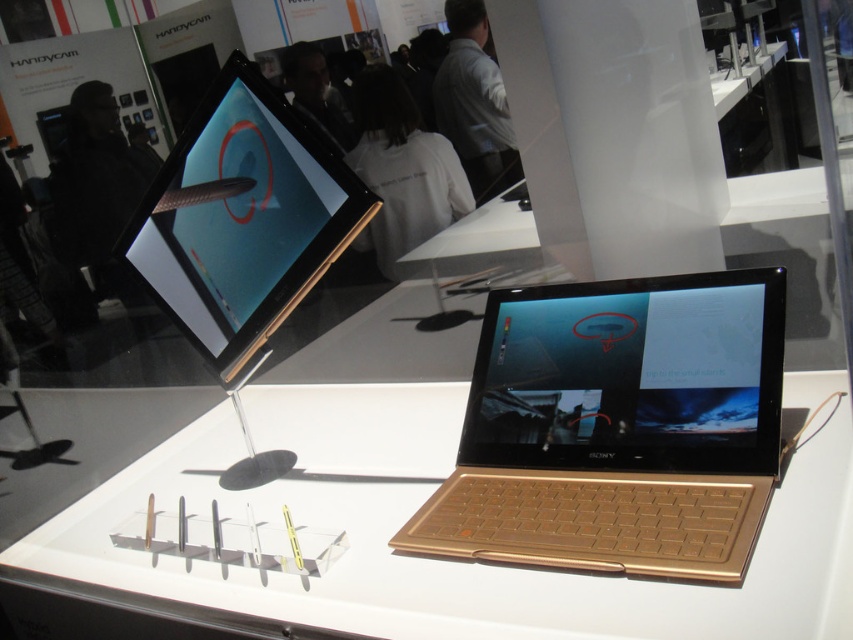
Question: Is gold metallic table at center positioned before gold metallic laptop at upper center?

Choices:
 (A) yes
 (B) no

Answer: (A)

Question: Which of the following is the farthest from the observer?

Choices:
 (A) gold metallic table at center
 (B) gold metallic laptop at center
 (C) gold metallic laptop at upper center

Answer: (C)

Question: Is gold metallic table at center closer to the viewer compared to gold metallic laptop at center?

Choices:
 (A) yes
 (B) no

Answer: (A)

Question: Which point is farther to the camera?

Choices:
 (A) (602, 600)
 (B) (486, 321)
 (C) (309, 234)

Answer: (B)

Question: Does gold metallic table at center come behind gold metallic laptop at center?

Choices:
 (A) no
 (B) yes

Answer: (A)

Question: Which point is closer to the camera?

Choices:
 (A) [653, 465]
 (B) [254, 148]

Answer: (A)